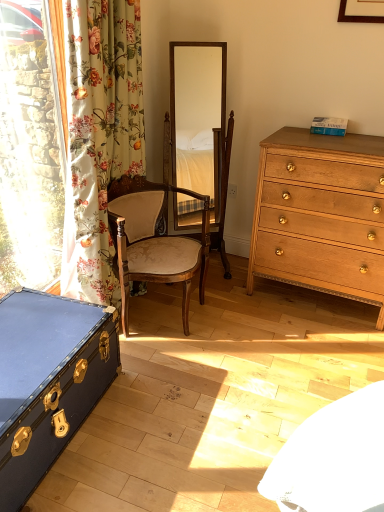
The image size is (384, 512). What do you see at coordinates (321, 214) in the screenshot? I see `light brown wood chest of drawers at right` at bounding box center [321, 214].

Where is `floral fabric curtain at left`? This screenshot has height=512, width=384. floral fabric curtain at left is located at coordinates (99, 137).

The width and height of the screenshot is (384, 512). What do you see at coordinates (47, 379) in the screenshot?
I see `blue leather trunk at lower left` at bounding box center [47, 379].

This screenshot has width=384, height=512. Find the location of `light brown wood chest of drawers at right`. light brown wood chest of drawers at right is located at coordinates (321, 214).

Measure the distance from white plastic power outlet at center to blue leather trunk at lower left.

5.16 feet.

Considering the sizes of objects white plastic power outlet at center and blue leather trunk at lower left in the image provided, who is bigger, white plastic power outlet at center or blue leather trunk at lower left?

With larger size is blue leather trunk at lower left.

Which object is closer to the camera, white plastic power outlet at center or blue leather trunk at lower left?

blue leather trunk at lower left is more forward.

Is white plastic power outlet at center positioned with its back to blue leather trunk at lower left?

No, white plastic power outlet at center is not facing the opposite direction of blue leather trunk at lower left.

From the image's perspective, is floral fabric curtain at left positioned above or below wooden mirror at center?

Clearly, from the image's perspective, floral fabric curtain at left is below wooden mirror at center.

Is floral fabric curtain at left facing towards wooden mirror at center?

No.

Considering the sizes of objects floral fabric curtain at left and wooden mirror at center in the image provided, who is bigger, floral fabric curtain at left or wooden mirror at center?

Bigger between the two is floral fabric curtain at left.

Considering the sizes of light brown wood chest of drawers at right and wooden mirror at center in the image, is light brown wood chest of drawers at right bigger or smaller than wooden mirror at center?

Considering their sizes, light brown wood chest of drawers at right takes up more space than wooden mirror at center.

From the image's perspective, between light brown wood chest of drawers at right and wooden mirror at center, which one is located above?

wooden mirror at center.

Between light brown wood chest of drawers at right and wooden mirror at center, which one has less height?

light brown wood chest of drawers at right.

Identify the location of mirror that appears behind the light brown wood chest of drawers at right. The width and height of the screenshot is (384, 512). (201, 124).

Which of these two, wooden mirror at center or wooden chair at center, is smaller?

Smaller between the two is wooden mirror at center.

From the image's perspective, does wooden mirror at center appear higher than wooden chair at center?

Indeed, from the image's perspective, wooden mirror at center is shown above wooden chair at center.

Is wooden mirror at center positioned with its back to wooden chair at center?

No.

Is floral fabric curtain at left at the back of blue leather trunk at lower left?

That's not correct — blue leather trunk at lower left is not looking away from floral fabric curtain at left.

Considering the sizes of objects blue leather trunk at lower left and floral fabric curtain at left in the image provided, who is taller, blue leather trunk at lower left or floral fabric curtain at left?

floral fabric curtain at left is taller.

Is blue leather trunk at lower left further to camera compared to floral fabric curtain at left?

No, it is not.

Considering the positions of objects wooden chair at center and blue leather trunk at lower left in the image provided, who is in front, wooden chair at center or blue leather trunk at lower left?

Positioned in front is blue leather trunk at lower left.

How much distance is there between wooden chair at center and blue leather trunk at lower left?

wooden chair at center is 22.28 inches from blue leather trunk at lower left.

How many degrees apart are the facing directions of wooden chair at center and blue leather trunk at lower left?

24 degrees.

Between wooden chair at center and blue leather trunk at lower left, which one has smaller size?

With smaller size is blue leather trunk at lower left.

Considering the relative sizes of light brown wood chest of drawers at right and wooden chair at center in the image provided, is light brown wood chest of drawers at right wider than wooden chair at center?

Incorrect, the width of light brown wood chest of drawers at right does not surpass that of wooden chair at center.

Considering the sizes of light brown wood chest of drawers at right and wooden chair at center in the image, is light brown wood chest of drawers at right bigger or smaller than wooden chair at center?

In the image, light brown wood chest of drawers at right appears to be larger than wooden chair at center.

Can you see light brown wood chest of drawers at right touching wooden chair at center?

light brown wood chest of drawers at right and wooden chair at center are clearly separated.

Could you tell me if light brown wood chest of drawers at right is facing wooden chair at center?

No, light brown wood chest of drawers at right is not aimed at wooden chair at center.

The width and height of the screenshot is (384, 512). In the image, there is a blue leather trunk at lower left. What are the coordinates of `power outlet above it (from the image's perspective)` in the screenshot? It's located at (232, 191).

The width and height of the screenshot is (384, 512). I want to click on curtain that is on the left side of wooden mirror at center, so click(x=99, y=137).

Considering their positions, is light brown wood chest of drawers at right positioned closer to white plastic power outlet at center than wooden chair at center?

Among the two, light brown wood chest of drawers at right is located nearer to white plastic power outlet at center.

Which object lies further to the anchor point wooden mirror at center, floral fabric curtain at left or light brown wood chest of drawers at right?

floral fabric curtain at left is further to wooden mirror at center.

Based on their spatial positions, is light brown wood chest of drawers at right or wooden mirror at center closer to floral fabric curtain at left?

light brown wood chest of drawers at right is positioned closer to the anchor floral fabric curtain at left.

Looking at the image, which one is located further to white plastic power outlet at center, blue leather trunk at lower left or floral fabric curtain at left?

Among the two, blue leather trunk at lower left is located further to white plastic power outlet at center.

Looking at the image, which one is located further to light brown wood chest of drawers at right, white plastic power outlet at center or wooden chair at center?

Among the two, white plastic power outlet at center is located further to light brown wood chest of drawers at right.

Looking at the image, which one is located closer to wooden mirror at center, blue leather trunk at lower left or wooden chair at center?

wooden chair at center lies closer to wooden mirror at center than the other object.

Estimate the real-world distances between objects in this image. Which object is further from blue leather trunk at lower left, wooden chair at center or floral fabric curtain at left?

floral fabric curtain at left is further to blue leather trunk at lower left.

Based on the photo, when comparing their distances from blue leather trunk at lower left, does wooden mirror at center or white plastic power outlet at center seem closer?

The object closer to blue leather trunk at lower left is white plastic power outlet at center.

You are a GUI agent. You are given a task and a screenshot of the screen. Output one action in this format:
    pyautogui.click(x=<x>, y=<y>)
    Task: Click on the mirror positioned between blue leather trunk at lower left and white plastic power outlet at center from near to far
    The image size is (384, 512).
    Given the screenshot: What is the action you would take?
    pyautogui.click(x=201, y=124)

In order to click on chair located between blue leather trunk at lower left and light brown wood chest of drawers at right in the left-right direction in this screenshot , I will do `click(154, 241)`.

Locate an element on the screen. This screenshot has height=512, width=384. chest of drawers between wooden chair at center and white plastic power outlet at center from front to back is located at coordinates pos(321,214).

The width and height of the screenshot is (384, 512). I want to click on chair between floral fabric curtain at left and light brown wood chest of drawers at right in the horizontal direction, so click(154, 241).